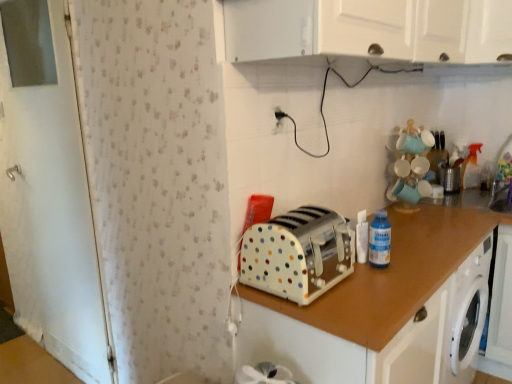
Measure the distance between point (335,12) and camera.

The distance of point (335,12) from camera is 1.06 meters.

The height and width of the screenshot is (384, 512). Describe the element at coordinates (279, 119) in the screenshot. I see `white plastic electric outlet at upper center` at that location.

In order to face white plastic electric outlet at upper center, should I rotate leftwards or rightwards?

You should rotate right by 3.131 degrees.

What are the coordinates of `blue plastic bottle at upper right` in the screenshot? It's located at (380, 240).

The image size is (512, 384). What do you see at coordinates (411, 168) in the screenshot?
I see `matte white cups at upper right` at bounding box center [411, 168].

Describe the element at coordinates (502, 199) in the screenshot. This screenshot has height=384, width=512. I see `transparent plastic sink at lower right` at that location.

Image resolution: width=512 pixels, height=384 pixels. Find the location of `white glossy cabinet at upper center, marked as the 2th cabinetry in a bottom-to-top arrangement`. white glossy cabinet at upper center, marked as the 2th cabinetry in a bottom-to-top arrangement is located at coordinates coord(369,29).

Between white polka dot plastic toaster at center and matte white cups at upper right, which one appears on the left side from the viewer's perspective?

white polka dot plastic toaster at center is more to the left.

Locate an element on the screen. This screenshot has height=384, width=512. toaster below the matte white cups at upper right (from the image's perspective) is located at coordinates (298, 254).

In the scene shown: In terms of height, does white polka dot plastic toaster at center look taller or shorter compared to matte white cups at upper right?

In the image, white polka dot plastic toaster at center appears to be shorter than matte white cups at upper right.

Who is bigger, white polka dot plastic toaster at center or matte white cups at upper right?

white polka dot plastic toaster at center.

Is white polka dot toaster at center, which is the second cabinetry from top to bottom, bigger than metallic silver toaster at upper right?

Indeed, white polka dot toaster at center, which is the second cabinetry from top to bottom, has a larger size compared to metallic silver toaster at upper right.

From the picture: Is white polka dot toaster at center, which is the second cabinetry from top to bottom, not close to metallic silver toaster at upper right?

Yes, white polka dot toaster at center, which is the second cabinetry from top to bottom, and metallic silver toaster at upper right are located far from each other.

Which object is thinner, white polka dot toaster at center, which appears as the first cabinetry when ordered from the bottom, or metallic silver toaster at upper right?

metallic silver toaster at upper right is thinner.

Which is in front, white plastic electric outlet at upper center or matte white cups at upper right?

white plastic electric outlet at upper center is in front.

Is white plastic electric outlet at upper center positioned with its back to matte white cups at upper right?

No, white plastic electric outlet at upper center is not facing away from matte white cups at upper right.

Is white plastic electric outlet at upper center shorter than matte white cups at upper right?

Yes, white plastic electric outlet at upper center is shorter than matte white cups at upper right.

Could matte white cups at upper right be considered to be inside white plastic electric outlet at upper center?

No, matte white cups at upper right is not a part of white plastic electric outlet at upper center.

Between blue plastic bottle at upper right and metallic silver toaster at upper right, which one appears on the left side from the viewer's perspective?

Positioned to the left is blue plastic bottle at upper right.

Are blue plastic bottle at upper right and metallic silver toaster at upper right far apart?

blue plastic bottle at upper right is far away from metallic silver toaster at upper right.

From their relative heights in the image, would you say blue plastic bottle at upper right is taller or shorter than metallic silver toaster at upper right?

Considering their sizes, blue plastic bottle at upper right has more height than metallic silver toaster at upper right.

Considering the relative sizes of blue plastic bottle at upper right and metallic silver toaster at upper right in the image provided, is blue plastic bottle at upper right bigger than metallic silver toaster at upper right?

Incorrect, blue plastic bottle at upper right is not larger than metallic silver toaster at upper right.

In order to click on electric outlet behind the blue plastic bottle at upper right in this screenshot , I will do `click(279, 119)`.

Consider the image. Is white plastic electric outlet at upper center far away from blue plastic bottle at upper right?

white plastic electric outlet at upper center is near blue plastic bottle at upper right, not far away.

Would you say white plastic electric outlet at upper center is inside or outside blue plastic bottle at upper right?

white plastic electric outlet at upper center is located beyond the bounds of blue plastic bottle at upper right.

Is white plastic electric outlet at upper center oriented away from blue plastic bottle at upper right?

white plastic electric outlet at upper center does not have its back to blue plastic bottle at upper right.

Is white glossy cabinet at upper center, marked as the 2th cabinetry in a bottom-to-top arrangement, looking in the opposite direction of white polka dot plastic toaster at center?

No, white glossy cabinet at upper center, marked as the 2th cabinetry in a bottom-to-top arrangement,'s orientation is not away from white polka dot plastic toaster at center.

Is white glossy cabinet at upper center, which ranks as the first cabinetry in top-to-bottom order, far away from white polka dot plastic toaster at center?

No, white glossy cabinet at upper center, which ranks as the first cabinetry in top-to-bottom order, is not far from white polka dot plastic toaster at center.

Is white glossy cabinet at upper center, which ranks as the first cabinetry in top-to-bottom order, taller or shorter than white polka dot plastic toaster at center?

Considering their sizes, white glossy cabinet at upper center, which ranks as the first cabinetry in top-to-bottom order, has more height than white polka dot plastic toaster at center.

Between white glossy cabinet at upper center, marked as the 2th cabinetry in a bottom-to-top arrangement, and white polka dot plastic toaster at center, which one has smaller width?

With smaller width is white polka dot plastic toaster at center.

Considering the relative sizes of white polka dot toaster at center, which appears as the first cabinetry when ordered from the bottom, and white polka dot plastic toaster at center in the image provided, is white polka dot toaster at center, which appears as the first cabinetry when ordered from the bottom, thinner than white polka dot plastic toaster at center?

In fact, white polka dot toaster at center, which appears as the first cabinetry when ordered from the bottom, might be wider than white polka dot plastic toaster at center.

From a real-world perspective, between white polka dot toaster at center, which is the second cabinetry from top to bottom, and white polka dot plastic toaster at center, who is vertically higher?

white polka dot plastic toaster at center.

Is white polka dot toaster at center, which is the second cabinetry from top to bottom, positioned before white polka dot plastic toaster at center?

Yes, it is in front of white polka dot plastic toaster at center.

Would you say white polka dot toaster at center, which appears as the first cabinetry when ordered from the bottom, is outside white polka dot plastic toaster at center?

Yes, white polka dot toaster at center, which appears as the first cabinetry when ordered from the bottom, is outside of white polka dot plastic toaster at center.

Locate an element on the screen. toaster on the left of matte white cups at upper right is located at coordinates (298, 254).

Locate an element on the screen. The width and height of the screenshot is (512, 384). cabinetry below the metallic silver toaster at upper right (from the image's perspective) is located at coordinates (385, 342).

From the image, which object appears to be farther from white polka dot toaster at center, which is the second cabinetry from top to bottom, transparent plastic sink at lower right or metallic silver toaster at upper right?

Based on the image, metallic silver toaster at upper right appears to be further to white polka dot toaster at center, which is the second cabinetry from top to bottom.

From the image, which object appears to be farther from metallic silver toaster at upper right, transparent plastic sink at lower right or white polka dot toaster at center, which is the second cabinetry from top to bottom?

white polka dot toaster at center, which is the second cabinetry from top to bottom.

Looking at the image, which one is located further to metallic silver toaster at upper right, matte white cups at upper right or blue plastic bottle at upper right?

Based on the image, blue plastic bottle at upper right appears to be further to metallic silver toaster at upper right.

Which object lies further to the anchor point white glossy cabinet at upper center, marked as the 2th cabinetry in a bottom-to-top arrangement, transparent plastic sink at lower right or metallic silver toaster at upper right?

transparent plastic sink at lower right is further to white glossy cabinet at upper center, marked as the 2th cabinetry in a bottom-to-top arrangement.

In the scene shown: Looking at the image, which one is located further to blue plastic bottle at upper right, white polka dot toaster at center, which is the second cabinetry from top to bottom, or metallic silver toaster at upper right?

metallic silver toaster at upper right is positioned further to the anchor blue plastic bottle at upper right.

When comparing their distances from matte white cups at upper right, does white polka dot toaster at center, which appears as the first cabinetry when ordered from the bottom, or white plastic electric outlet at upper center seem closer?

white polka dot toaster at center, which appears as the first cabinetry when ordered from the bottom, is closer to matte white cups at upper right.

Considering their positions, is white polka dot plastic toaster at center positioned further to white glossy cabinet at upper center, which ranks as the first cabinetry in top-to-bottom order, than metallic silver toaster at upper right?

metallic silver toaster at upper right lies further to white glossy cabinet at upper center, which ranks as the first cabinetry in top-to-bottom order, than the other object.

Considering their positions, is white glossy cabinet at upper center, marked as the 2th cabinetry in a bottom-to-top arrangement, positioned closer to white plastic electric outlet at upper center than white polka dot plastic toaster at center?

white polka dot plastic toaster at center is closer to white plastic electric outlet at upper center.

The image size is (512, 384). I want to click on toy located between white polka dot plastic toaster at center and transparent plastic sink at lower right in the left-right direction, so click(x=411, y=168).

Locate an element on the screen. toaster between white polka dot toaster at center, which is the second cabinetry from top to bottom, and metallic silver toaster at upper right from front to back is located at coordinates (298, 254).

Where is `toy located between blue plastic bottle at upper right and transparent plastic sink at lower right in the left-right direction`? Image resolution: width=512 pixels, height=384 pixels. toy located between blue plastic bottle at upper right and transparent plastic sink at lower right in the left-right direction is located at coordinates (411, 168).

The height and width of the screenshot is (384, 512). Identify the location of bottle that lies between white glossy cabinet at upper center, which ranks as the first cabinetry in top-to-bottom order, and white polka dot toaster at center, which appears as the first cabinetry when ordered from the bottom, from top to bottom. tap(380, 240).